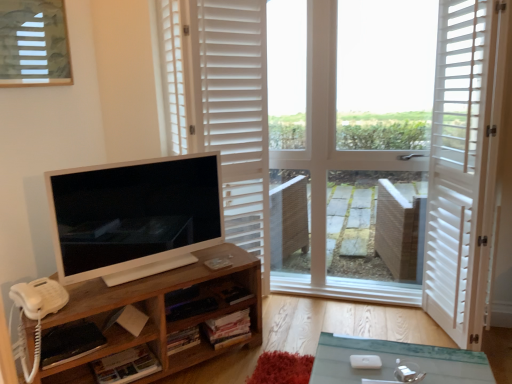
Question: Can you confirm if white matte shutters at upper center is wider than satin white monitor at left?

Choices:
 (A) yes
 (B) no

Answer: (A)

Question: Can we say white matte shutters at upper center lies outside satin white monitor at left?

Choices:
 (A) yes
 (B) no

Answer: (A)

Question: Does white matte shutters at upper center have a lesser height compared to satin white monitor at left?

Choices:
 (A) yes
 (B) no

Answer: (B)

Question: From a real-world perspective, is white matte shutters at upper center beneath satin white monitor at left?

Choices:
 (A) yes
 (B) no

Answer: (B)

Question: From the image's perspective, is white matte shutters at upper center located beneath satin white monitor at left?

Choices:
 (A) yes
 (B) no

Answer: (B)

Question: Does white matte shutters at upper center appear on the right side of satin white monitor at left?

Choices:
 (A) yes
 (B) no

Answer: (A)

Question: Can you confirm if satin white monitor at left is wider than woodenobject at left?

Choices:
 (A) yes
 (B) no

Answer: (B)

Question: Can we say satin white monitor at left lies outside woodenobject at left?

Choices:
 (A) no
 (B) yes

Answer: (B)

Question: Is satin white monitor at left further to the viewer compared to woodenobject at left?

Choices:
 (A) no
 (B) yes

Answer: (B)

Question: Is satin white monitor at left facing away from woodenobject at left?

Choices:
 (A) no
 (B) yes

Answer: (A)

Question: Are satin white monitor at left and woodenobject at left making contact?

Choices:
 (A) no
 (B) yes

Answer: (A)

Question: Is satin white monitor at left far away from woodenobject at left?

Choices:
 (A) yes
 (B) no

Answer: (B)

Question: From a real-world perspective, is satin white monitor at left positioned under white matte shutters at upper center based on gravity?

Choices:
 (A) no
 (B) yes

Answer: (B)